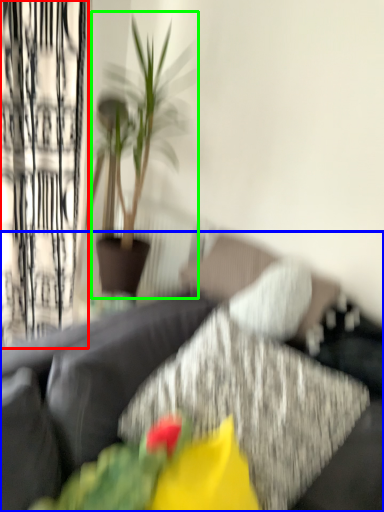
Question: Estimate the real-world distances between objects in this image. Which object is farther from curtain (highlighted by a red box), studio couch (highlighted by a blue box) or houseplant (highlighted by a green box)?

Choices:
 (A) studio couch
 (B) houseplant

Answer: (A)